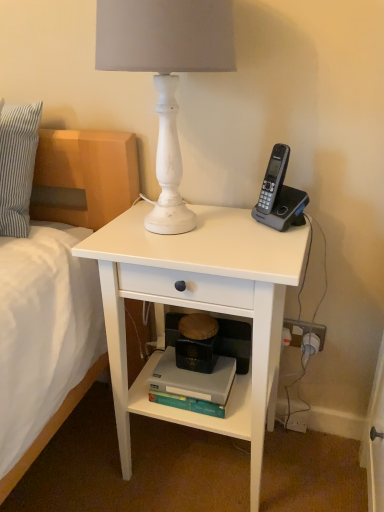
Question: Are white matte desk at center and gray plastic phone at upper right making contact?

Choices:
 (A) yes
 (B) no

Answer: (B)

Question: Does white matte desk at center have a lesser width compared to gray plastic phone at upper right?

Choices:
 (A) no
 (B) yes

Answer: (A)

Question: Is white matte desk at center bigger than gray plastic phone at upper right?

Choices:
 (A) yes
 (B) no

Answer: (A)

Question: From the image's perspective, would you say white matte desk at center is shown under gray plastic phone at upper right?

Choices:
 (A) no
 (B) yes

Answer: (B)

Question: Would you say gray plastic phone at upper right is part of white matte desk at center's contents?

Choices:
 (A) yes
 (B) no

Answer: (B)

Question: From a real-world perspective, is white matte desk at center below gray plastic phone at upper right?

Choices:
 (A) yes
 (B) no

Answer: (A)

Question: Are white striped pillow at left and white matte desk at center making contact?

Choices:
 (A) no
 (B) yes

Answer: (A)

Question: Could white matte desk at center be considered to be inside white striped pillow at left?

Choices:
 (A) no
 (B) yes

Answer: (A)

Question: From the image's perspective, would you say white striped pillow at left is positioned over white matte desk at center?

Choices:
 (A) no
 (B) yes

Answer: (B)

Question: From a real-world perspective, is white striped pillow at left located higher than white matte desk at center?

Choices:
 (A) yes
 (B) no

Answer: (A)

Question: Is the position of white striped pillow at left less distant than that of white matte desk at center?

Choices:
 (A) yes
 (B) no

Answer: (B)

Question: Is the depth of white striped pillow at left greater than that of white matte desk at center?

Choices:
 (A) yes
 (B) no

Answer: (A)

Question: Is white matte lamp at upper center positioned with its back to gray plastic phone at upper right?

Choices:
 (A) no
 (B) yes

Answer: (A)